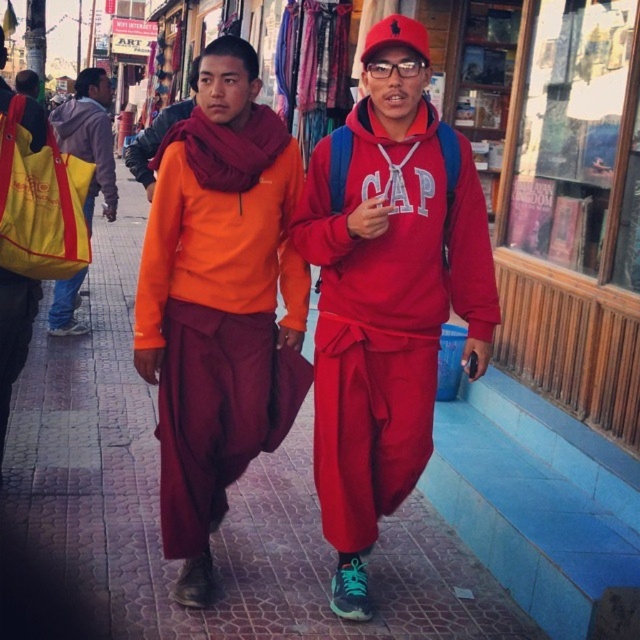
Question: Which object is the farthest from the maroon cotton robe at center?

Choices:
 (A) matte orange sweater at center
 (B) red cotton robe at center
 (C) yellow fabric bag at left

Answer: (C)

Question: Is maroon cotton robe at center bigger than red cotton robe at center?

Choices:
 (A) no
 (B) yes

Answer: (A)

Question: Which point is farther from the camera taking this photo?

Choices:
 (A) (67, 280)
 (B) (333, 214)
 (C) (202, 400)

Answer: (A)

Question: Can you confirm if matte orange sweater at center is thinner than yellow fabric bag at left?

Choices:
 (A) no
 (B) yes

Answer: (A)

Question: Can you confirm if matte orange sweater at center is bigger than yellow fabric bag at left?

Choices:
 (A) no
 (B) yes

Answer: (B)

Question: Which of the following is the farthest from the observer?

Choices:
 (A) pos(438,337)
 (B) pos(449,301)

Answer: (A)